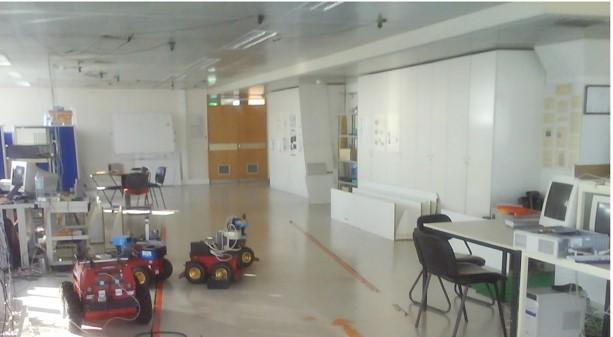
Find the location of a particular element. chairs is located at coordinates (425, 256), (432, 217), (131, 177), (135, 192), (159, 171), (141, 166), (116, 165), (104, 185).